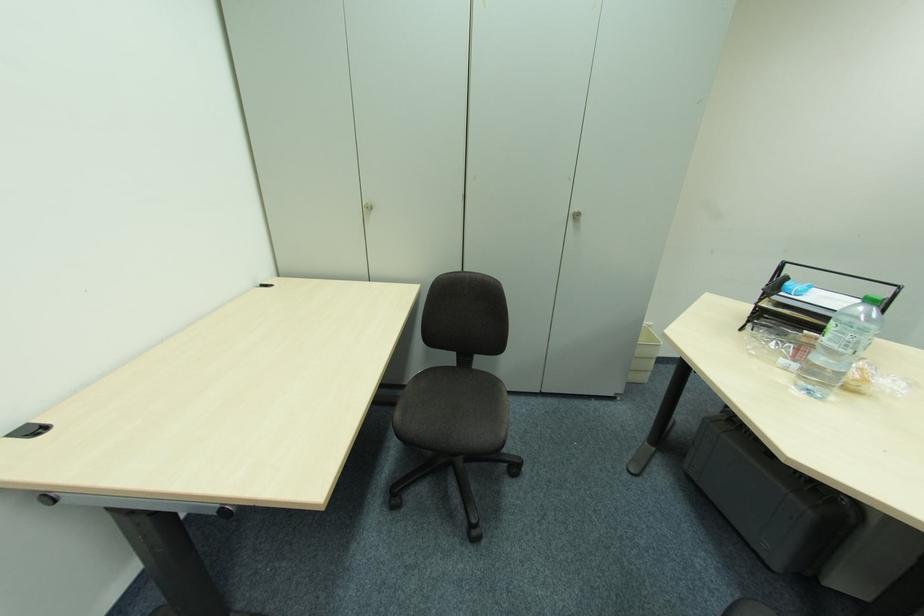
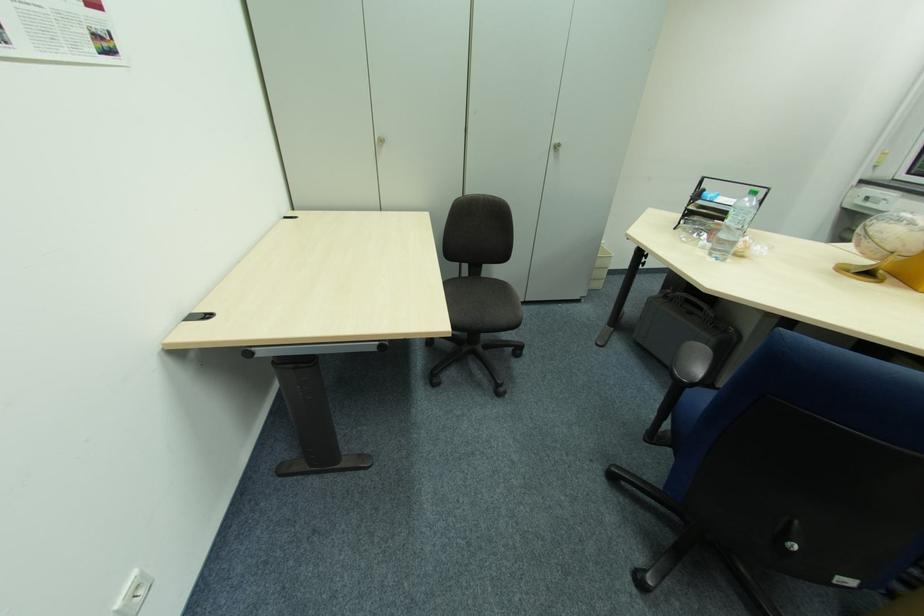
Find the pixel in the second image that matches (850,347) in the first image.

(743, 224)